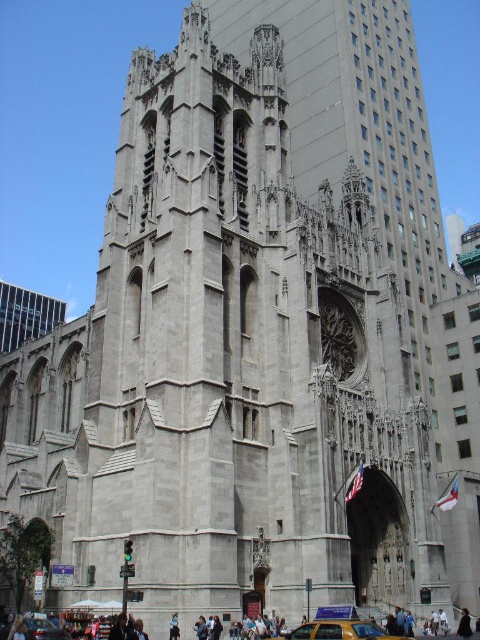
How far apart are yellow metallic taxi cab at lower center and black leather jacket at lower right?

yellow metallic taxi cab at lower center is 28.46 meters from black leather jacket at lower right.

Is point (36, 636) positioned after point (465, 632)?

No, it is not.

This screenshot has height=640, width=480. In order to click on yellow metallic taxi cab at lower center in this screenshot , I will do `click(36, 628)`.

From the picture: Does yellow matte taxi at lower center lie behind yellow metallic taxi cab at lower center?

No, it is not.

Between yellow matte taxi at lower center and yellow metallic taxi cab at lower center, which one is positioned lower?

yellow matte taxi at lower center is below.

This screenshot has height=640, width=480. What do you see at coordinates (344, 628) in the screenshot?
I see `yellow matte taxi at lower center` at bounding box center [344, 628].

Locate an element on the screen. Image resolution: width=480 pixels, height=640 pixels. yellow matte taxi at lower center is located at coordinates (344, 628).

Between yellow matte taxi at lower center and black leather jacket at lower right, which one is positioned higher?

yellow matte taxi at lower center

Is yellow matte taxi at lower center in front of black leather jacket at lower right?

Yes, it is.

Who is more forward, (391,618) or (460,627)?

Positioned in front is point (460,627).

The image size is (480, 640). Identify the location of yellow matte taxi at lower center. (344, 628).